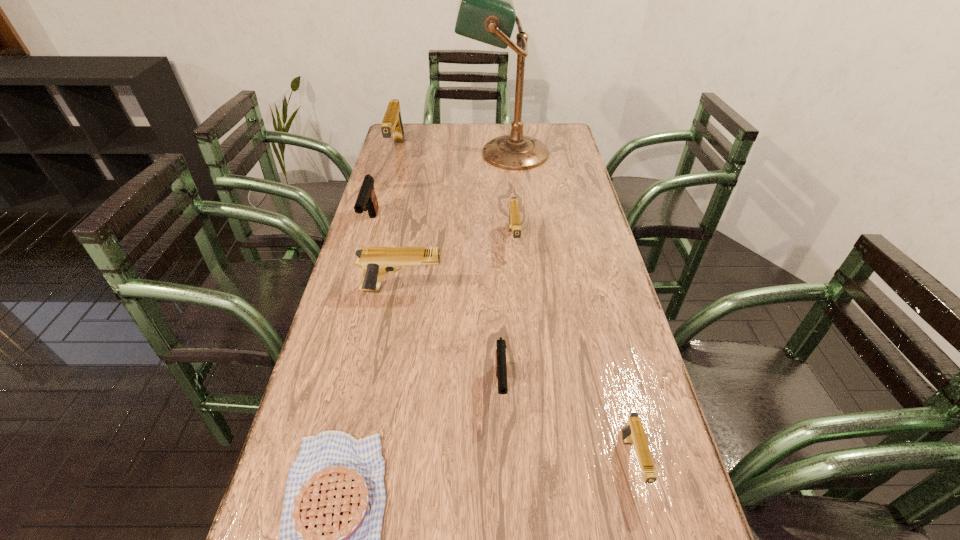
Where is `object that is the fourth closest to the fourth nearest object`? The height and width of the screenshot is (540, 960). object that is the fourth closest to the fourth nearest object is located at coordinates (331, 522).

Where is `object that is the fifth nearest to the third nearest pistol`? The width and height of the screenshot is (960, 540). object that is the fifth nearest to the third nearest pistol is located at coordinates (486, 13).

Identify which pistol is the fifth closest to the shortest object. Please provide its 2D coordinates. Your answer should be formatted as a tuple, i.e. [(x, y)], where the tuple contains the x and y coordinates of a point satisfying the conditions above.

[(366, 200)]

Locate which pistol ranks third in proximity to the shortest object. Please provide its 2D coordinates. Your answer should be formatted as a tuple, i.e. [(x, y)], where the tuple contains the x and y coordinates of a point satisfying the conditions above.

[(633, 433)]

Image resolution: width=960 pixels, height=540 pixels. In order to click on the closest tan pistol to the fifth pistol from left to right in this screenshot , I will do `click(375, 261)`.

Locate which tan pistol is the closest to the right black pistol. Please provide its 2D coordinates. Your answer should be formatted as a tuple, i.e. [(x, y)], where the tuple contains the x and y coordinates of a point satisfying the conditions above.

[(633, 433)]